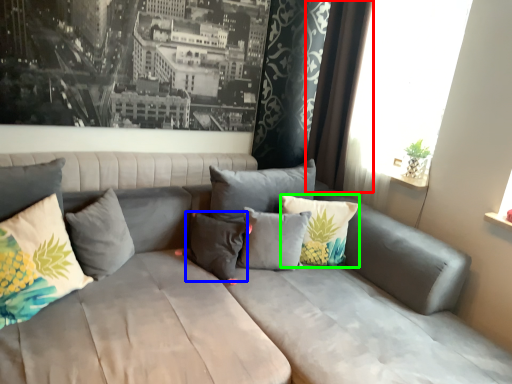
Question: Based on their relative distances, which object is farther from curtain (highlighted by a red box)? Choose from pillow (highlighted by a blue box) and pillow (highlighted by a green box).

Choices:
 (A) pillow
 (B) pillow

Answer: (A)